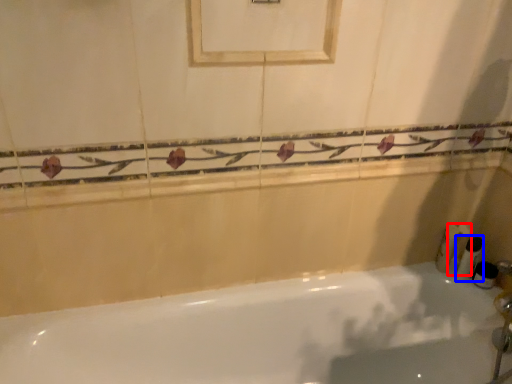
Question: Which object is closer to the camera taking this photo, toiletry (highlighted by a red box) or toiletry (highlighted by a blue box)?

Choices:
 (A) toiletry
 (B) toiletry

Answer: (B)